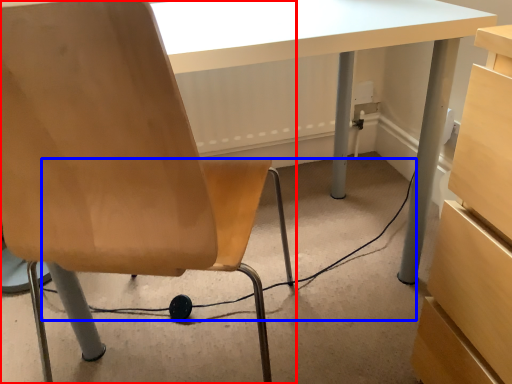
Question: Among these objects, which one is farthest to the camera, chair (highlighted by a red box) or cable (highlighted by a blue box)?

Choices:
 (A) chair
 (B) cable

Answer: (B)